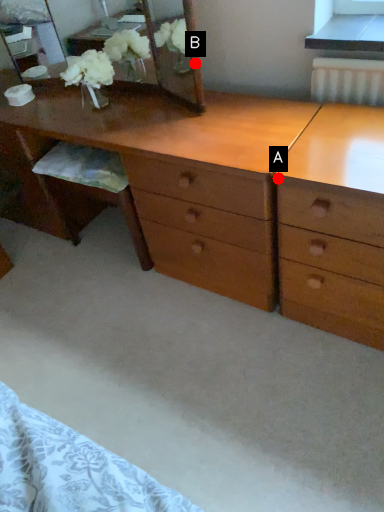
Question: Two points are circled on the image, labeled by A and B beside each circle. Which point is further to the camera?

Choices:
 (A) A is further
 (B) B is further

Answer: (B)